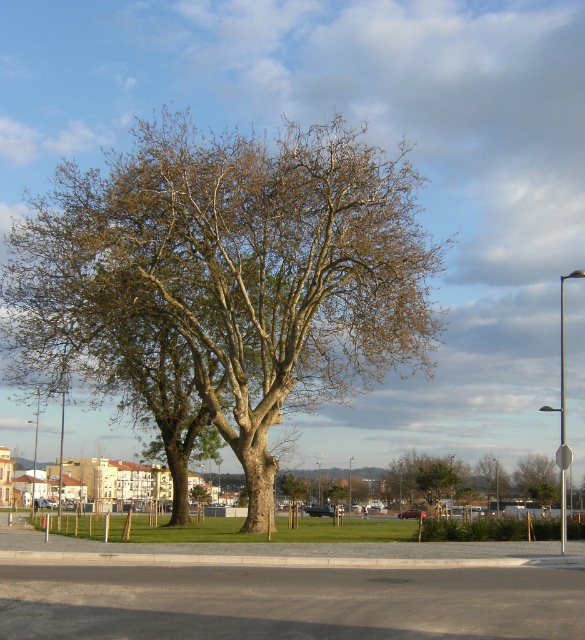
You are standing in the park and want to take a photo of the green rough bark tree at center and the green leafy tree at lower right. Which tree should you focus on first if you want to capture both in the same frame without moving the camera?

The green rough bark tree at center is positioned over the green leafy tree at lower right, so you should focus on the green rough bark tree at center first to ensure both are in the frame.

You are standing at the origin point of the coordinate system in the park. The green rough bark tree at center is located at position point 0.422, 0.409. If you want to walk straight towards the tree from your current position, which direction should you head?

The green rough bark tree at center is located at coordinates 0.422 on the x and 0.409 on the y axis. Since you are at the origin point, you should move northeast to reach the tree, as both coordinates are positive and the tree is positioned to the northeast direction from your current location.

You are a city planner assessing the space between two trees in the park. The green rough bark tree at center and the green leafy tree at lower right are both important for shade. Can a 100 feet long temporary walkway be placed between them without cutting into either tree?

The distance between the green rough bark tree at center and the green leafy tree at lower right is 101.10 feet. Since the walkway is 100 feet long, it can be placed between them as the available space is slightly longer than the walkway.